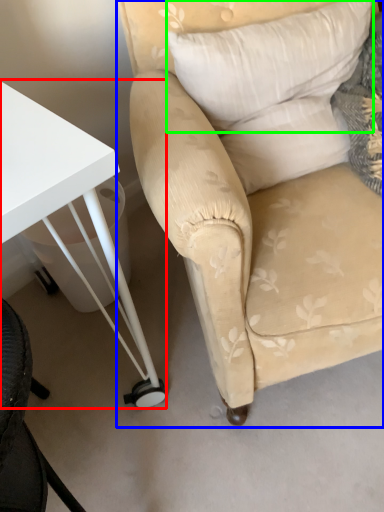
Question: Based on their relative distances, which object is nearer to table (highlighted by a red box)? Choose from chair (highlighted by a blue box) and pillow (highlighted by a green box).

Choices:
 (A) chair
 (B) pillow

Answer: (A)